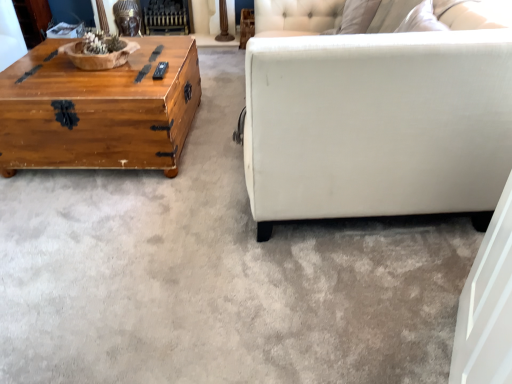
At what (x,y) coordinates should I click in order to perform the action: click on wooden chest at left. Please return your answer as a coordinate pair (x, y). This screenshot has height=384, width=512. Looking at the image, I should click on (99, 111).

Describe the element at coordinates (99, 111) in the screenshot. The image size is (512, 384). I see `wooden chest at left` at that location.

What is the approximate height of wooden chest at left?

It is 17.08 inches.

Find the location of a particular element. black metal fireplace at upper center is located at coordinates (166, 17).

What do you see at coordinates (166, 17) in the screenshot?
I see `black metal fireplace at upper center` at bounding box center [166, 17].

At what (x,y) coordinates should I click in order to perform the action: click on wooden chest at left. Please return your answer as a coordinate pair (x, y). Looking at the image, I should click on (99, 111).

In the image, is black metal fireplace at upper center on the left side or the right side of wooden chest at left?

Clearly, black metal fireplace at upper center is on the right of wooden chest at left in the image.

Which object is more forward, black metal fireplace at upper center or wooden chest at left?

wooden chest at left is closer to the camera.

Between point (164, 32) and point (12, 158), which one is positioned behind?

The point (164, 32) is more distant.

From the image's perspective, is black metal fireplace at upper center under wooden chest at left?

No.

From a real-world perspective, is black metal fireplace at upper center positioned above or below wooden chest at left?

From a real-world perspective, black metal fireplace at upper center is physically below wooden chest at left.

Is black metal fireplace at upper center wider than wooden chest at left?

In fact, black metal fireplace at upper center might be narrower than wooden chest at left.

Is black metal fireplace at upper center shorter than wooden chest at left?

Yes, black metal fireplace at upper center is shorter than wooden chest at left.

Considering the sizes of objects black metal fireplace at upper center and wooden chest at left in the image provided, who is bigger, black metal fireplace at upper center or wooden chest at left?

wooden chest at left.

Is black metal fireplace at upper center not within wooden chest at left?

Indeed, black metal fireplace at upper center is completely outside wooden chest at left.

Is there a large distance between black metal fireplace at upper center and wooden chest at left?

Absolutely, black metal fireplace at upper center is distant from wooden chest at left.

Could you tell me if black metal fireplace at upper center is turned towards wooden chest at left?

Yes, black metal fireplace at upper center is facing wooden chest at left.

Where is `fireplace behind the wooden chest at left`? This screenshot has width=512, height=384. fireplace behind the wooden chest at left is located at coordinates (166, 17).

Which is more to the left, wooden chest at left or black metal fireplace at upper center?

wooden chest at left is more to the left.

From the picture: Considering their positions, is wooden chest at left located in front of or behind black metal fireplace at upper center?

Clearly, wooden chest at left is in front of black metal fireplace at upper center.

Does point (54, 66) come in front of point (155, 4)?

Yes.

From the image's perspective, relative to black metal fireplace at upper center, is wooden chest at left above or below?

wooden chest at left is situated lower than black metal fireplace at upper center in the image.

From a real-world perspective, is wooden chest at left physically below black metal fireplace at upper center?

Incorrect, from a real-world perspective, wooden chest at left is higher than black metal fireplace at upper center.

Can you confirm if wooden chest at left is thinner than black metal fireplace at upper center?

Incorrect, the width of wooden chest at left is not less than that of black metal fireplace at upper center.

Considering the sizes of objects wooden chest at left and black metal fireplace at upper center in the image provided, who is shorter, wooden chest at left or black metal fireplace at upper center?

black metal fireplace at upper center is shorter.

Is wooden chest at left smaller than black metal fireplace at upper center?

No.

Is wooden chest at left inside or outside of black metal fireplace at upper center?

wooden chest at left is not inside black metal fireplace at upper center, it's outside.

Is wooden chest at left beside black metal fireplace at upper center?

No, wooden chest at left is not beside black metal fireplace at upper center.

Is wooden chest at left facing away from black metal fireplace at upper center?

That's right, wooden chest at left is facing away from black metal fireplace at upper center.

Measure the distance from wooden chest at left to black metal fireplace at upper center.

wooden chest at left is 5.80 feet from black metal fireplace at upper center.

Identify the location of coffee table on the left of black metal fireplace at upper center. The width and height of the screenshot is (512, 384). (99, 111).

Where is `fireplace below the wooden chest at left (from a real-world perspective)`? This screenshot has width=512, height=384. fireplace below the wooden chest at left (from a real-world perspective) is located at coordinates (166, 17).

Identify the location of coffee table below the black metal fireplace at upper center (from the image's perspective). The image size is (512, 384). (99, 111).